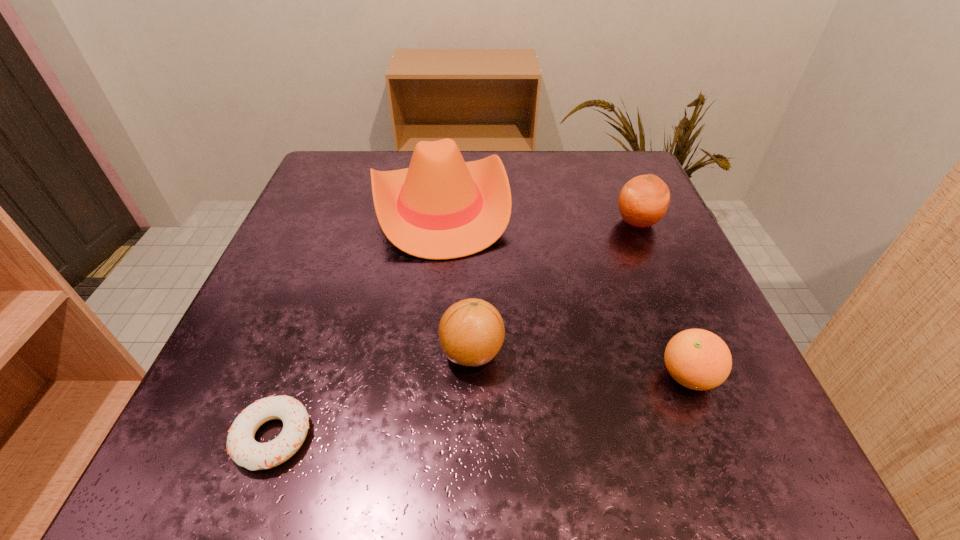
The height and width of the screenshot is (540, 960). Find the location of `the tallest object`. the tallest object is located at coordinates (441, 207).

Identify the location of the farthest orange. This screenshot has width=960, height=540. (643, 201).

Identify the location of the leftmost orange. The width and height of the screenshot is (960, 540). (471, 332).

Identify the location of the fourth tallest object. (698, 359).

Identify the location of doughnut. Image resolution: width=960 pixels, height=540 pixels. (241, 446).

Where is `the nearest object`? This screenshot has height=540, width=960. the nearest object is located at coordinates (241, 446).

The width and height of the screenshot is (960, 540). I want to click on vacant space situated on the right of the cowboy hat, so click(x=648, y=207).

In order to click on blank space located on the back of the farthest orange in this screenshot , I will do `click(624, 189)`.

Locate an element on the screen. Image resolution: width=960 pixels, height=540 pixels. vacant space located 0.100m on the front of the leftmost orange is located at coordinates point(470,449).

Where is `free space located on the left of the fourth tallest object`? The image size is (960, 540). free space located on the left of the fourth tallest object is located at coordinates (376, 376).